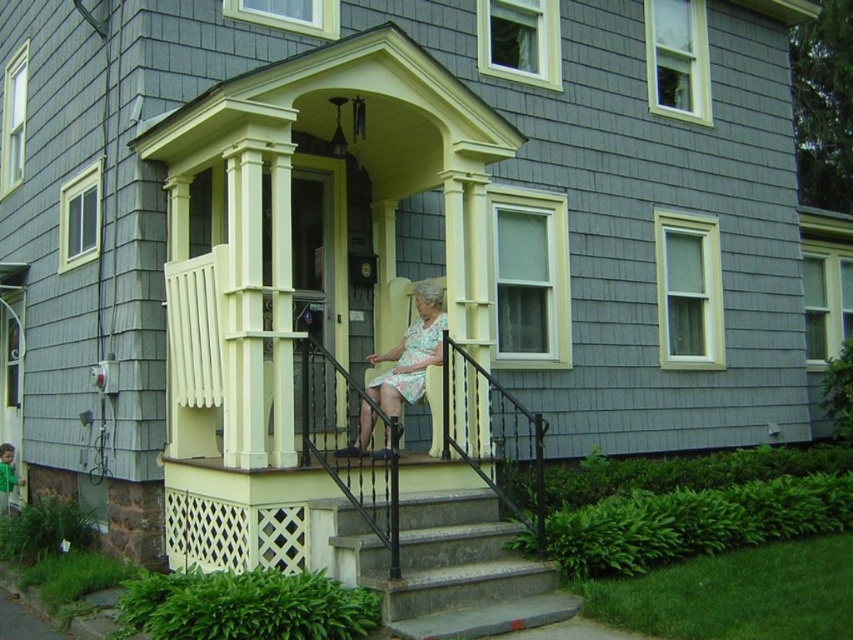
You are standing at the bottom of the concrete steps at center and want to reach the woman in the floral print fabric dress at center. Which direction should you move to get closer to her?

The concrete steps at center is shorter than the floral print fabric dress at center, so you should move forward up the steps to get closer to the woman in the floral print fabric dress at center.

You are standing on the porch of the house and want to walk towards the front door. There are two points marked on the path. Which point should you step on first, point (x=474, y=554) or point (x=422, y=374)?

You should step on point (x=474, y=554) first because it is in front of point (x=422, y=374), so it comes before the other point along the path towards the door.